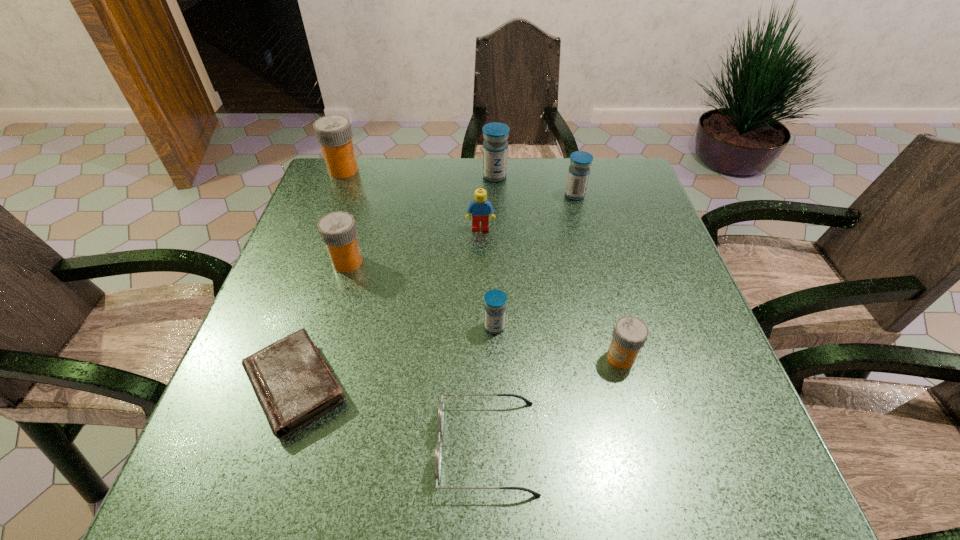
You are a GUI agent. You are given a task and a screenshot of the screen. Output one action in this format:
    pyautogui.click(x=<x>, y=<y>)
    Task: Click on the vacant area between the shortest object and the second nearest blue medicine
    
    Given the screenshot: What is the action you would take?
    pyautogui.click(x=435, y=290)

Where is `free space between the diary and the second smallest blue medicine`? Image resolution: width=960 pixels, height=540 pixels. free space between the diary and the second smallest blue medicine is located at coordinates (435, 290).

Find the location of a particular element. The width and height of the screenshot is (960, 540). vacant space that's between the second smallest blue medicine and the nearest orange medicine is located at coordinates (598, 276).

The height and width of the screenshot is (540, 960). What are the coordinates of `free space between the Lego and the third farthest object` in the screenshot? It's located at (528, 212).

Where is `vacant point located between the diary and the leftmost medicine`? vacant point located between the diary and the leftmost medicine is located at coordinates (320, 278).

Where is `free space between the second smallest blue medicine and the leftmost orange medicine`? Image resolution: width=960 pixels, height=540 pixels. free space between the second smallest blue medicine and the leftmost orange medicine is located at coordinates (459, 183).

This screenshot has height=540, width=960. In order to click on vacant area that lies between the biggest blue medicine and the leftmost orange medicine in this screenshot , I will do `click(419, 173)`.

Find the location of a particular element. The image size is (960, 540). the closest object to the sunglasses is located at coordinates (495, 300).

The height and width of the screenshot is (540, 960). Find the location of `object that can be found as the fourth closest to the sunglasses`. object that can be found as the fourth closest to the sunglasses is located at coordinates (338, 231).

Choose which medicine is the nearest neighbor to the second orange medicine from left to right. Please provide its 2D coordinates. Your answer should be formatted as a tuple, i.e. [(x, y)], where the tuple contains the x and y coordinates of a point satisfying the conditions above.

[(334, 133)]